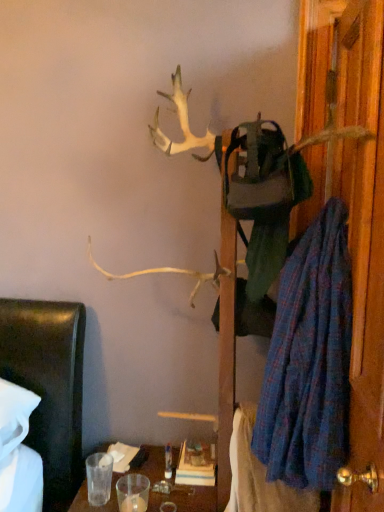
Question: Would you say wooden door at right is a long distance from blue plaid robe at right?

Choices:
 (A) yes
 (B) no

Answer: (B)

Question: From a real-world perspective, is wooden door at right positioned under blue plaid robe at right based on gravity?

Choices:
 (A) no
 (B) yes

Answer: (A)

Question: Is wooden door at right at the right side of blue plaid robe at right?

Choices:
 (A) no
 (B) yes

Answer: (B)

Question: Can we say wooden door at right lies outside blue plaid robe at right?

Choices:
 (A) no
 (B) yes

Answer: (B)

Question: Does wooden door at right come in front of blue plaid robe at right?

Choices:
 (A) no
 (B) yes

Answer: (B)

Question: From the image's perspective, relative to blue plaid robe at right, is wooden door at right above or below?

Choices:
 (A) below
 (B) above

Answer: (B)

Question: Is wooden door at right inside the boundaries of blue plaid robe at right, or outside?

Choices:
 (A) outside
 (B) inside

Answer: (A)

Question: Considering the positions of point (372, 321) and point (278, 425), is point (372, 321) closer or farther from the camera than point (278, 425)?

Choices:
 (A) farther
 (B) closer

Answer: (B)

Question: From a real-world perspective, is wooden door at right positioned above or below blue plaid robe at right?

Choices:
 (A) above
 (B) below

Answer: (A)

Question: Is wooden door at right bigger or smaller than blue plaid blanket at lower right?

Choices:
 (A) big
 (B) small

Answer: (A)

Question: Considering the positions of point (375, 464) and point (279, 486), is point (375, 464) closer or farther from the camera than point (279, 486)?

Choices:
 (A) closer
 (B) farther

Answer: (A)

Question: From the image's perspective, relative to blue plaid blanket at lower right, is wooden door at right above or below?

Choices:
 (A) above
 (B) below

Answer: (A)

Question: Is wooden door at right in front of or behind blue plaid blanket at lower right in the image?

Choices:
 (A) behind
 (B) front

Answer: (B)

Question: Would you say blue plaid robe at right is to the left or to the right of blue plaid blanket at lower right in the picture?

Choices:
 (A) left
 (B) right

Answer: (B)

Question: Considering the positions of blue plaid robe at right and blue plaid blanket at lower right in the image, is blue plaid robe at right taller or shorter than blue plaid blanket at lower right?

Choices:
 (A) short
 (B) tall

Answer: (B)